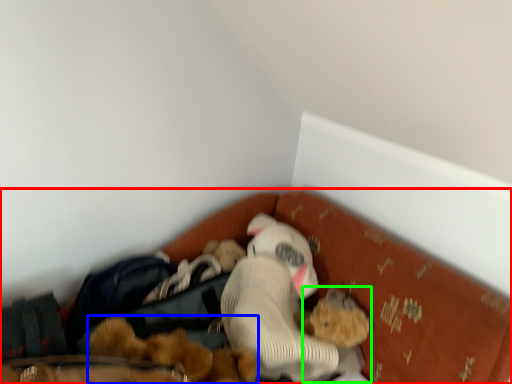
Question: Considering the real-world distances, which object is farthest from bed (highlighted by a red box)? toy (highlighted by a blue box) or toy (highlighted by a green box)?

Choices:
 (A) toy
 (B) toy

Answer: (B)